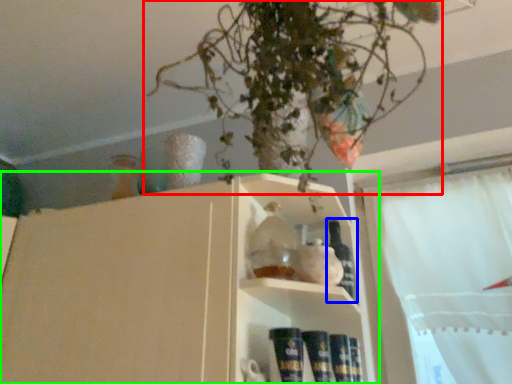
Question: Which is nearer to the houseplant (highlighted by a red box)? bottle (highlighted by a blue box) or shelf (highlighted by a green box).

Choices:
 (A) bottle
 (B) shelf

Answer: (B)